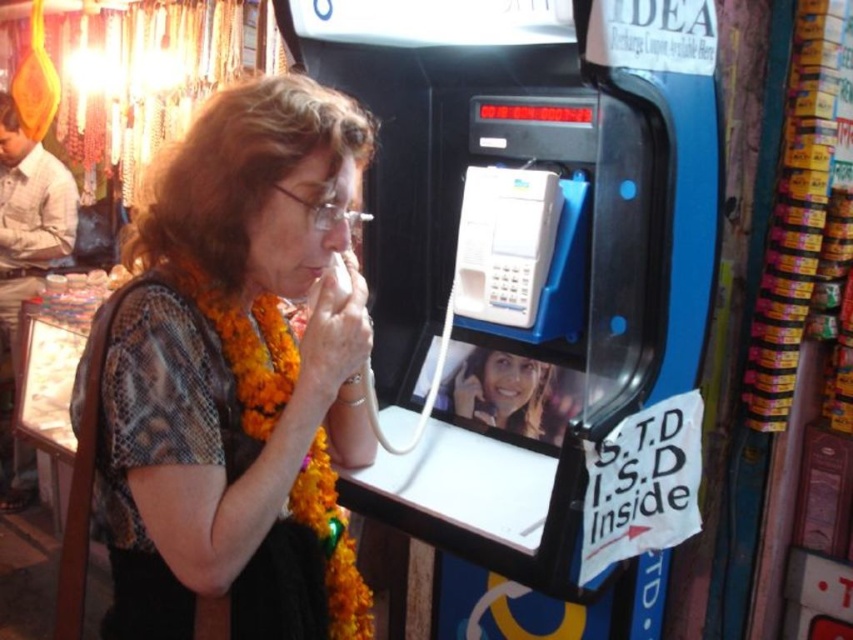
Question: Can you confirm if matte brown blouse at center is bigger than white plastic payphone at center?

Choices:
 (A) yes
 (B) no

Answer: (A)

Question: Is matte brown blouse at center wider than white plastic payphone at center?

Choices:
 (A) yes
 (B) no

Answer: (A)

Question: Does matte brown blouse at center have a larger size compared to white plastic payphone at center?

Choices:
 (A) no
 (B) yes

Answer: (B)

Question: Which point appears closest to the camera in this image?

Choices:
 (A) [x=515, y=172]
 (B) [x=318, y=280]

Answer: (B)